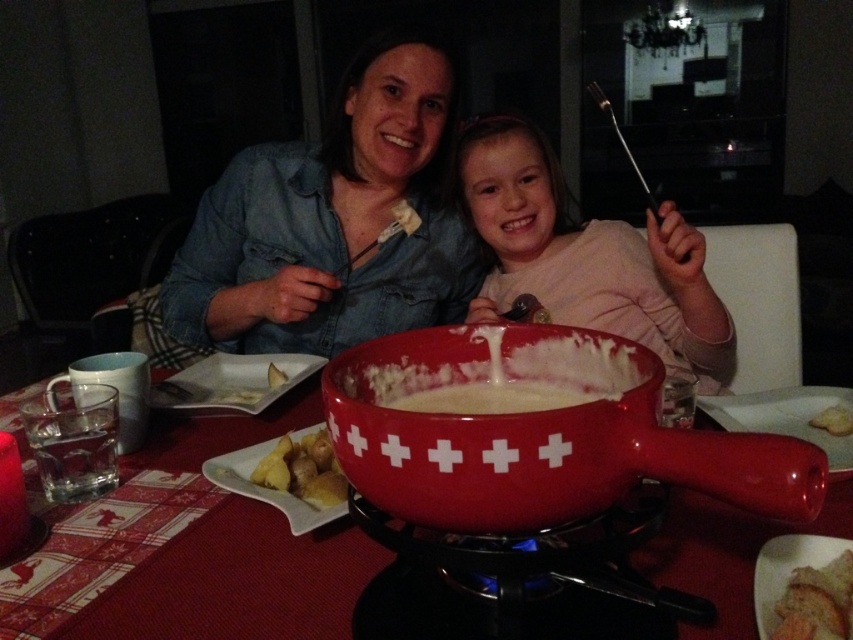
Question: Where is matte pink sweater at center located in relation to golden potato at center in the image?

Choices:
 (A) left
 (B) right

Answer: (B)

Question: Which point is closer to the camera?

Choices:
 (A) (843, 636)
 (B) (314, 540)
 (C) (204, 236)

Answer: (A)

Question: Does matte blue denim shirt at center have a lesser width compared to matte pink sweater at center?

Choices:
 (A) yes
 (B) no

Answer: (B)

Question: Observing the image, what is the correct spatial positioning of matte ceramic fondue pot at center in reference to slightly toasted bread at lower right?

Choices:
 (A) below
 (B) above

Answer: (B)

Question: Which of the following is the farthest from the observer?

Choices:
 (A) (312, 502)
 (B) (782, 604)
 (C) (529, 260)

Answer: (C)

Question: Which of the following is the farthest from the observer?

Choices:
 (A) smooth ceramic fondue pot at center
 (B) matte blue denim shirt at center
 (C) golden potato at center

Answer: (B)